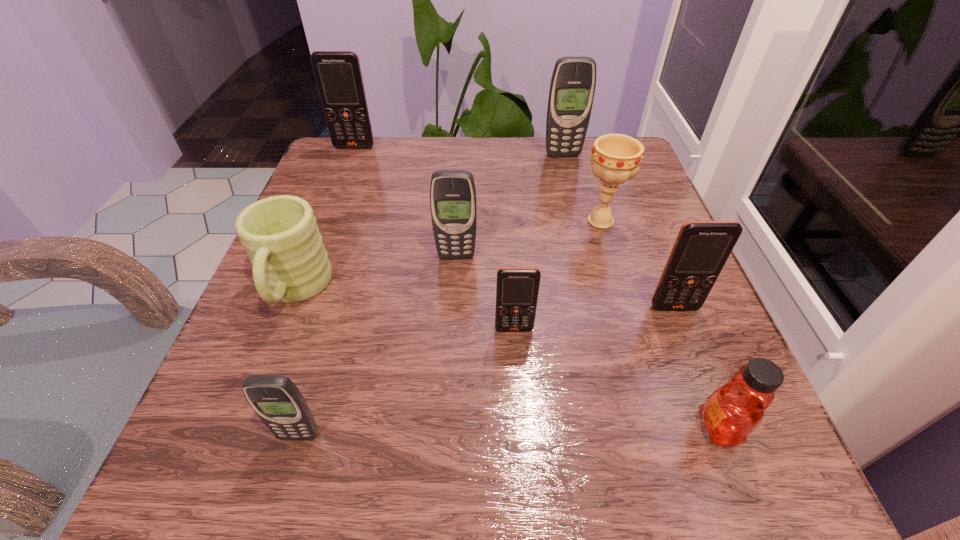
At what (x,y) coordinates should I click in order to perform the action: click on honey situated at the right edge. Please return your answer as a coordinate pair (x, y). This screenshot has width=960, height=540. Looking at the image, I should click on (733, 411).

Locate an element on the screen. object located in the far left corner section of the desktop is located at coordinates (338, 76).

This screenshot has height=540, width=960. I want to click on object situated at the near left corner, so click(277, 401).

You are a GUI agent. You are given a task and a screenshot of the screen. Output one action in this format:
    pyautogui.click(x=<x>, y=<y>)
    Task: Click on the object that is at the far right corner
    
    Given the screenshot: What is the action you would take?
    pyautogui.click(x=572, y=88)

This screenshot has width=960, height=540. In order to click on object present at the near right corner in this screenshot , I will do `click(733, 411)`.

The height and width of the screenshot is (540, 960). In the image, there is a desktop. What are the coordinates of `vacant region at the far edge` in the screenshot? It's located at (538, 156).

Find the location of a particular element. The width and height of the screenshot is (960, 540). vacant region at the near edge is located at coordinates (547, 469).

Locate an element on the screen. The image size is (960, 540). vacant area at the left edge is located at coordinates pyautogui.click(x=265, y=332).

At what (x,y) coordinates should I click in order to perform the action: click on vacant position at the right edge of the desktop. Please return your answer as a coordinate pair (x, y). Looking at the image, I should click on (673, 374).

At what (x,y) coordinates should I click in order to perform the action: click on vacant space at the far left corner of the desktop. Please return your answer as a coordinate pair (x, y). This screenshot has width=960, height=540. Looking at the image, I should click on (370, 186).